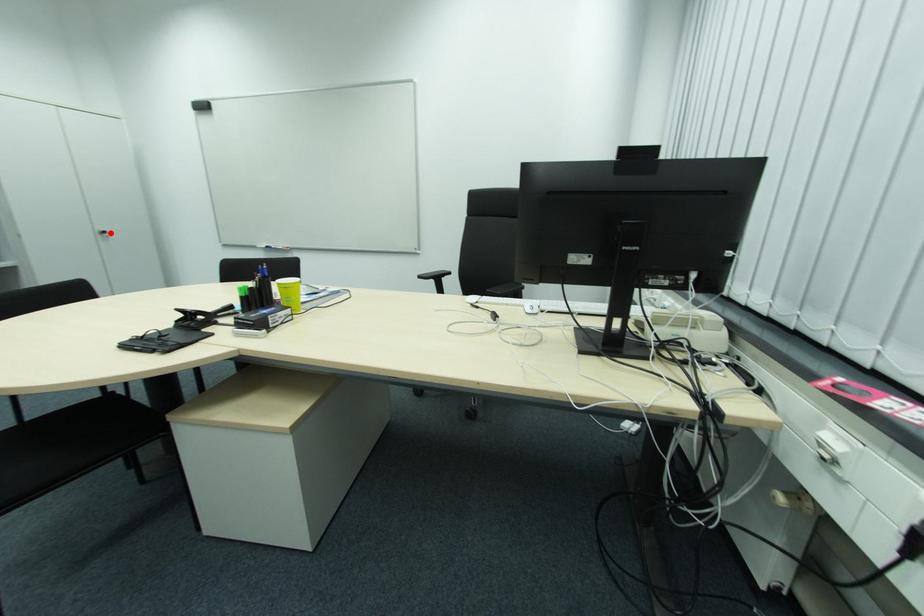
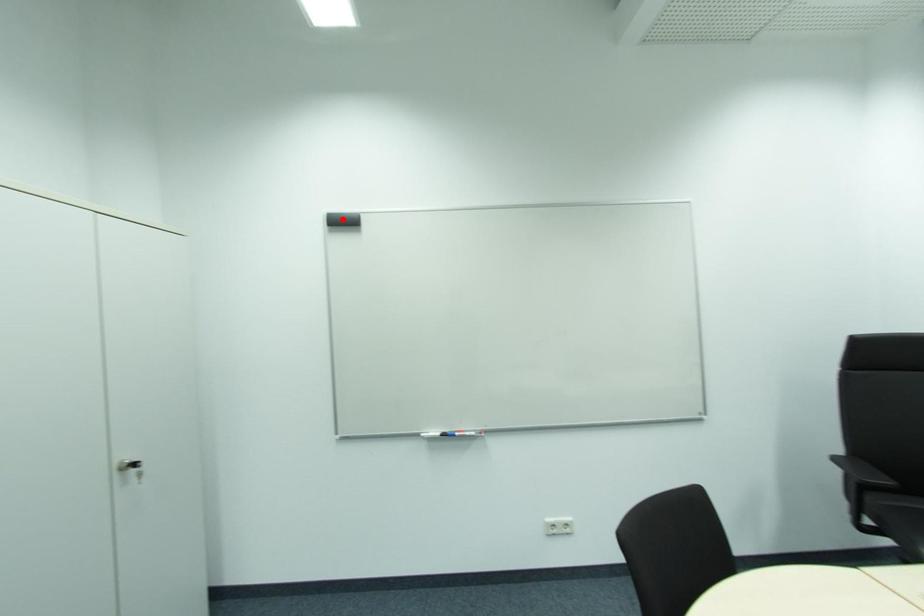
I am providing you with two images of the same scene from different viewpoints. A red point is marked on the first image and another point is marked on the second image. Is the red point in image1 aligned with the point shown in image2?

No